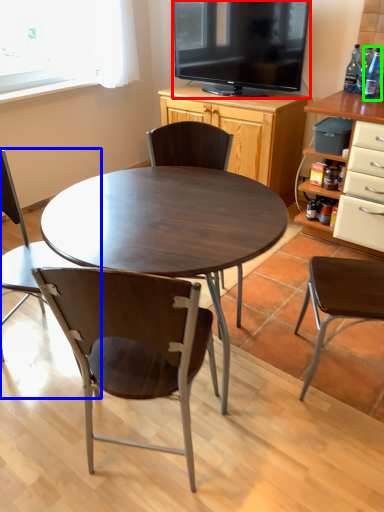
Question: Which object is the farthest from television (highlighted by a red box)? Choose among these: chair (highlighted by a blue box) or bottle (highlighted by a green box).

Choices:
 (A) chair
 (B) bottle

Answer: (A)